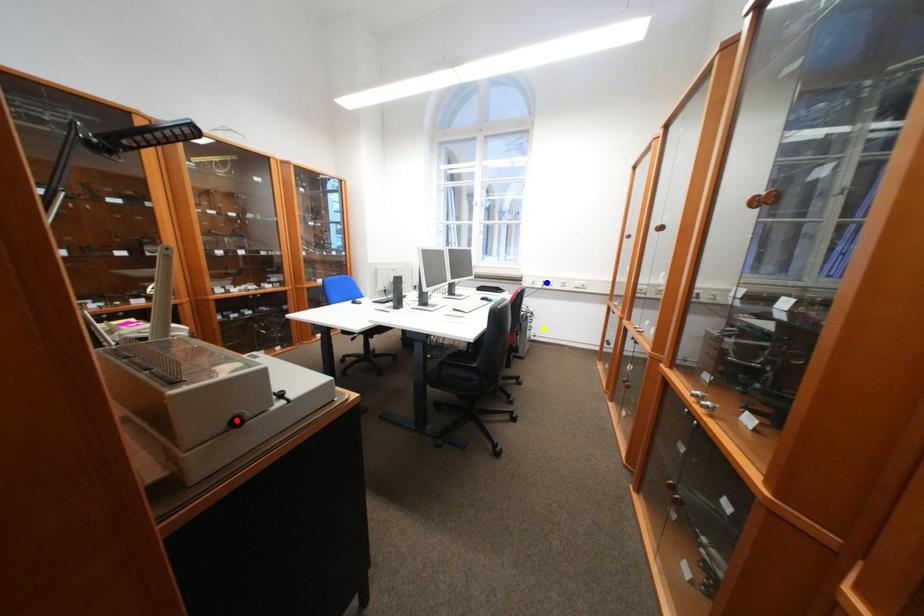
Order these from nearest to farthest:
- red point
- blue point
- yellow point

red point → yellow point → blue point